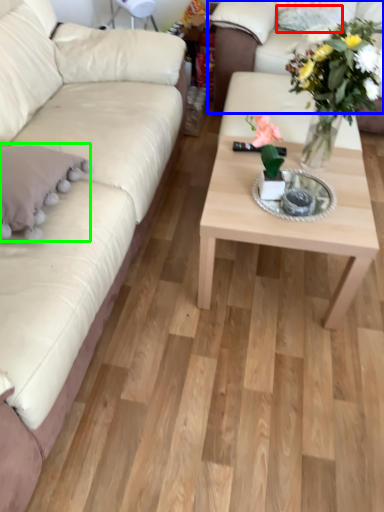
Question: Estimate the real-world distances between objects in this image. Which object is farther from pillow (highlighted by a red box), studio couch (highlighted by a blue box) or pillow (highlighted by a green box)?

Choices:
 (A) studio couch
 (B) pillow

Answer: (B)